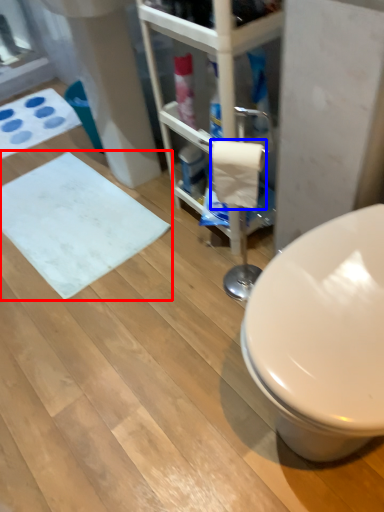
Question: Which of the following is the farthest to the observer, bath mat (highlighted by a red box) or toilet paper (highlighted by a blue box)?

Choices:
 (A) bath mat
 (B) toilet paper

Answer: (A)